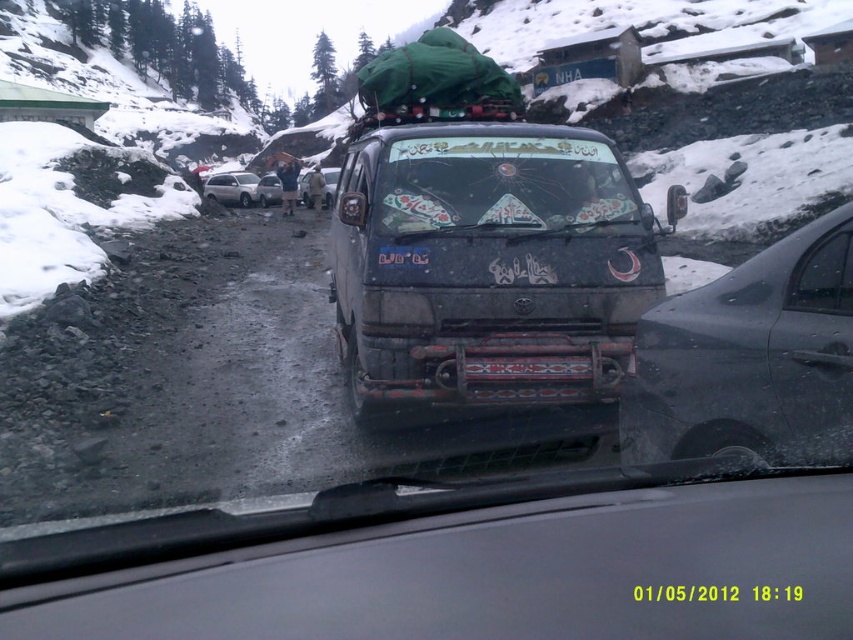
Does glossy metallic car at right appear over green fabric load at center?

Actually, glossy metallic car at right is below green fabric load at center.

Looking at this image, is glossy metallic car at right thinner than green fabric load at center?

Correct, glossy metallic car at right's width is less than green fabric load at center's.

Who is more distant from viewer, (838, 216) or (376, 118)?

The point (376, 118) is more distant.

You are a GUI agent. You are given a task and a screenshot of the screen. Output one action in this format:
    pyautogui.click(x=<x>, y=<y>)
    Task: Click on the glossy metallic car at right
    This screenshot has height=640, width=853.
    Given the screenshot: What is the action you would take?
    pyautogui.click(x=750, y=358)

Between dirty matte van at center and white matte car at center, which one is positioned lower?

dirty matte van at center

You are a GUI agent. You are given a task and a screenshot of the screen. Output one action in this format:
    pyautogui.click(x=<x>, y=<y>)
    Task: Click on the dirty matte van at center
    The height and width of the screenshot is (640, 853).
    Given the screenshot: What is the action you would take?
    pyautogui.click(x=485, y=262)

Looking at this image, does metallic silver van at center have a smaller size compared to metallic silver car at center?

Actually, metallic silver van at center might be larger than metallic silver car at center.

Who is more distant from viewer, (326,182) or (277,204)?

The point (277,204) is behind.

What do you see at coordinates (329, 182) in the screenshot? Image resolution: width=853 pixels, height=640 pixels. I see `metallic silver van at center` at bounding box center [329, 182].

Where is `metallic silver van at center`? metallic silver van at center is located at coordinates (329, 182).